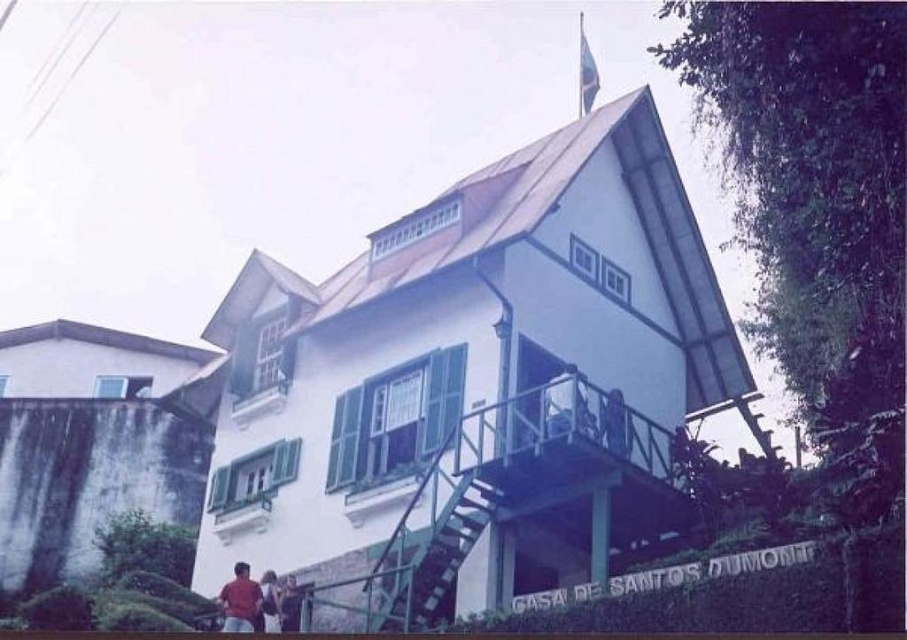
Measure the distance between matte red shirt at lower left and camera.

49.04 meters

Looking at this image, can you confirm if matte red shirt at lower left is wider than red shirt at lower left?

Yes, matte red shirt at lower left is wider than red shirt at lower left.

What do you see at coordinates (240, 600) in the screenshot? I see `matte red shirt at lower left` at bounding box center [240, 600].

The width and height of the screenshot is (907, 640). What are the coordinates of `matte red shirt at lower left` in the screenshot? It's located at (240, 600).

Is metallic staircase at center bigger than white painted wood balcony at lower left?

Actually, metallic staircase at center might be smaller than white painted wood balcony at lower left.

Can you confirm if metallic staircase at center is shorter than white painted wood balcony at lower left?

No.

Identify the location of metallic staircase at center. This screenshot has height=640, width=907. (432, 557).

I want to click on metallic staircase at center, so click(432, 557).

Which is above, metallic staircase at center or matte red shirt at lower left?

metallic staircase at center is higher up.

Which is more to the left, metallic staircase at center or matte red shirt at lower left?

matte red shirt at lower left is more to the left.

Who is more forward, (x=445, y=596) or (x=242, y=612)?

Point (x=445, y=596) is in front.

I want to click on metallic staircase at center, so click(432, 557).